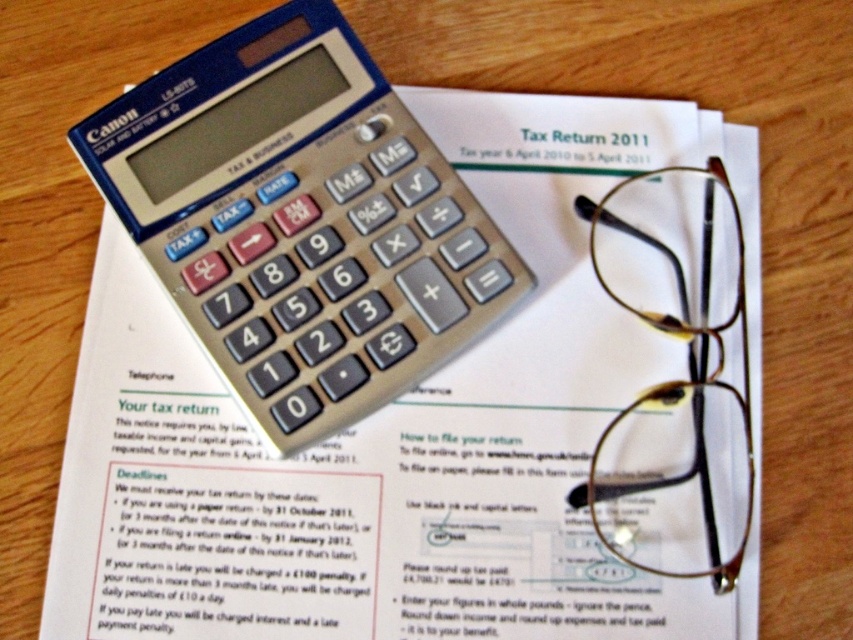
Between point (514, 532) and point (653, 465), which one is positioned behind?

Point (653, 465)

Identify the location of white paper at upper center. (396, 435).

Who is more distant from viewer, (419, 202) or (672, 564)?

The point (419, 202) is behind.

From the picture: Can you confirm if silver metallic calculator at center is taller than gold metallic glasses at upper right?

Yes.

Locate an element on the screen. This screenshot has width=853, height=640. silver metallic calculator at center is located at coordinates (300, 221).

Can you confirm if white paper at upper center is shorter than silver metallic calculator at center?

Incorrect, white paper at upper center's height does not fall short of silver metallic calculator at center's.

What do you see at coordinates (396, 435) in the screenshot?
I see `white paper at upper center` at bounding box center [396, 435].

At what (x,y) coordinates should I click in order to perform the action: click on white paper at upper center. Please return your answer as a coordinate pair (x, y). This screenshot has height=640, width=853. Looking at the image, I should click on (396, 435).